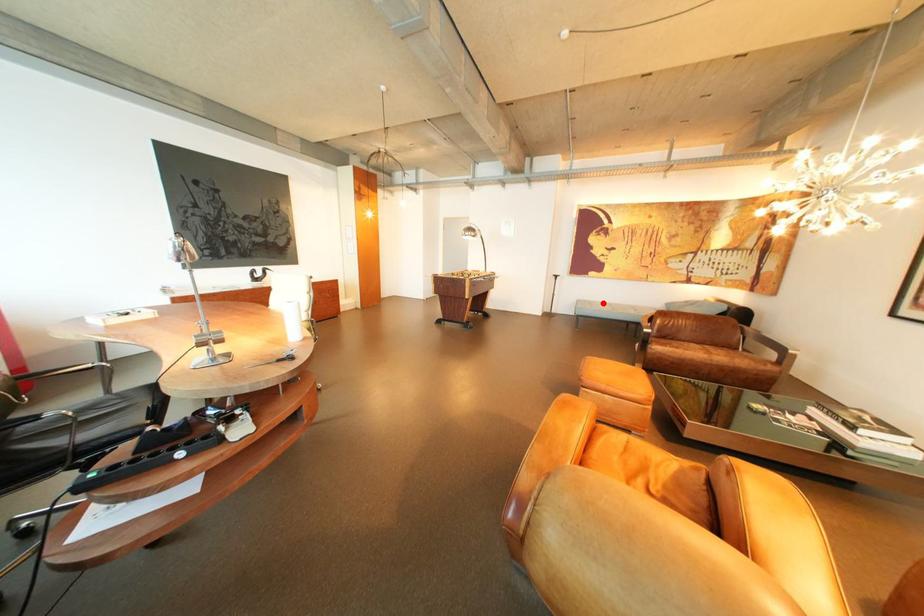
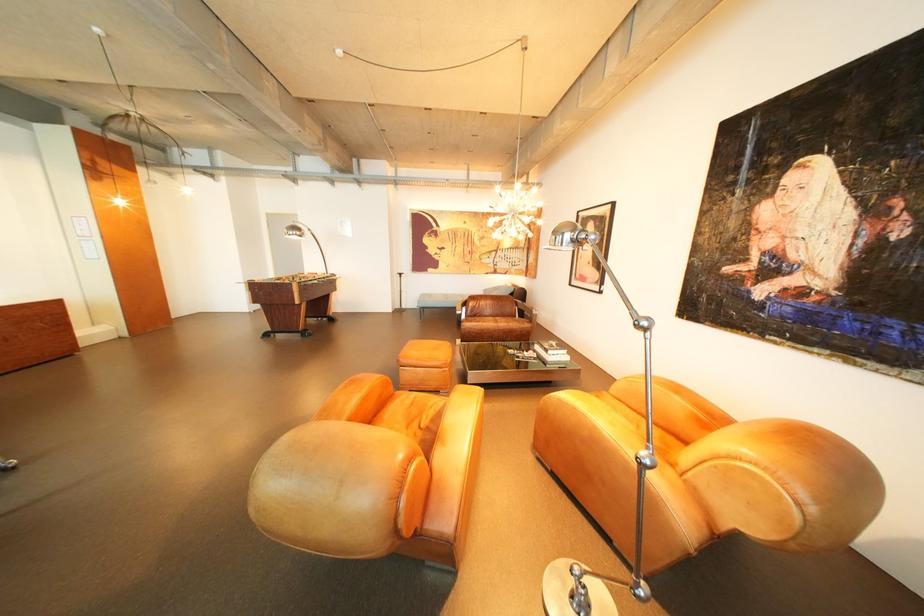
Find the pixel in the second image that matches the highlighted location in the first image.

(444, 296)